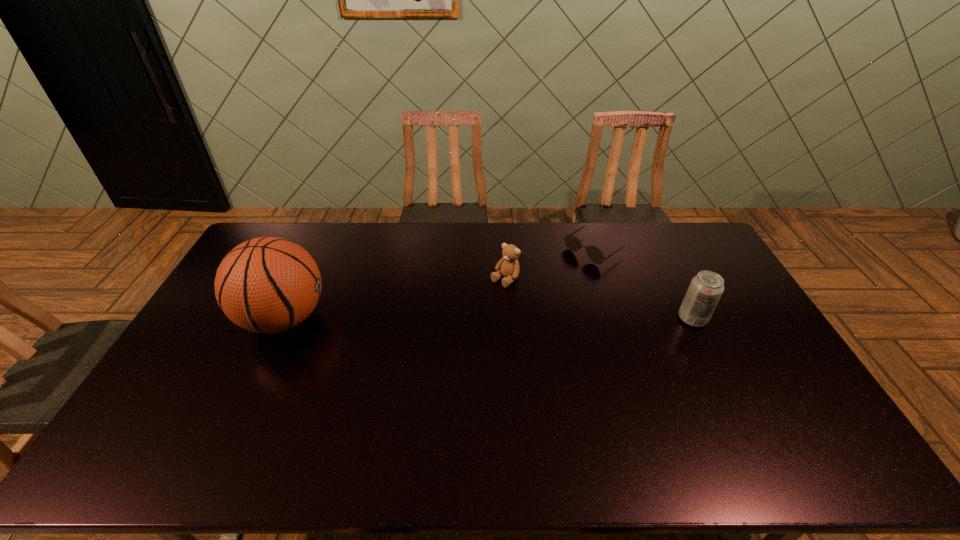
What are the coordinates of `vacant region between the tallest object and the rightmost object` in the screenshot? It's located at (489, 319).

You are a GUI agent. You are given a task and a screenshot of the screen. Output one action in this format:
    pyautogui.click(x=<x>, y=<y>)
    Task: Click on the empty location between the rightmost object and the basketball
    The height and width of the screenshot is (540, 960).
    Given the screenshot: What is the action you would take?
    pyautogui.click(x=489, y=319)

Locate an element on the screen. This screenshot has width=960, height=540. the second closest object to the third tallest object is located at coordinates click(x=706, y=288).

This screenshot has height=540, width=960. I want to click on object that is the third closest to the second shortest object, so click(x=268, y=285).

Image resolution: width=960 pixels, height=540 pixels. In order to click on vacant space that satisfies the following two spatial constraints: 1. on the back side of the shortest object; 2. on the right side of the teddy bear in this screenshot , I will do `click(503, 249)`.